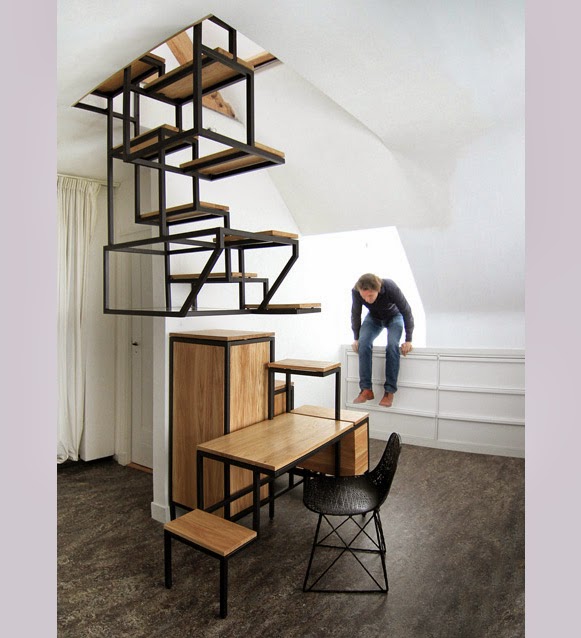
I want to click on floor, so click(450, 515).